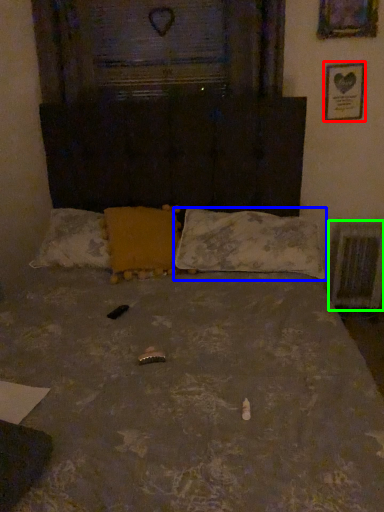
Question: Which object is positioned farthest from picture frame (highlighted by a red box)? Select from pillow (highlighted by a blue box) and radiator (highlighted by a green box).

Choices:
 (A) pillow
 (B) radiator

Answer: (A)